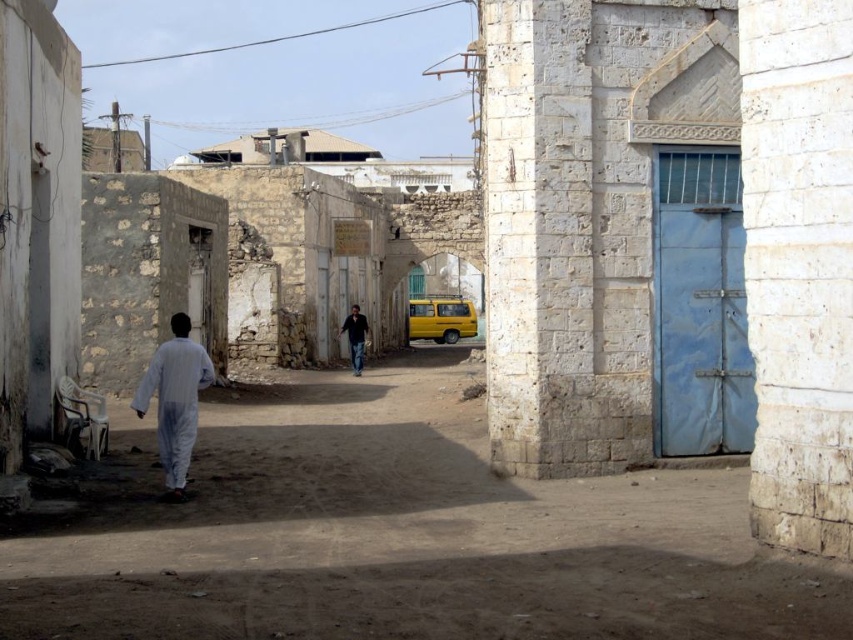
Does white stone alley at center come in front of white matte clothing at left?

Yes, it is in front of white matte clothing at left.

Is point (300, 609) more distant than point (192, 400)?

No, it is in front of (192, 400).

The width and height of the screenshot is (853, 640). I want to click on white stone alley at center, so click(398, 534).

Is white stone alley at center below dark blue jeans at center?

Indeed, white stone alley at center is positioned under dark blue jeans at center.

Can you confirm if white stone alley at center is positioned to the left of dark blue jeans at center?

No, white stone alley at center is not to the left of dark blue jeans at center.

Identify the location of white stone alley at center. (398, 534).

Can you confirm if white stone alley at center is shorter than yellow matte school bus at center?

Yes.

Is white stone alley at center to the left of yellow matte school bus at center from the viewer's perspective?

Yes, white stone alley at center is to the left of yellow matte school bus at center.

This screenshot has width=853, height=640. In order to click on white stone alley at center in this screenshot , I will do `click(398, 534)`.